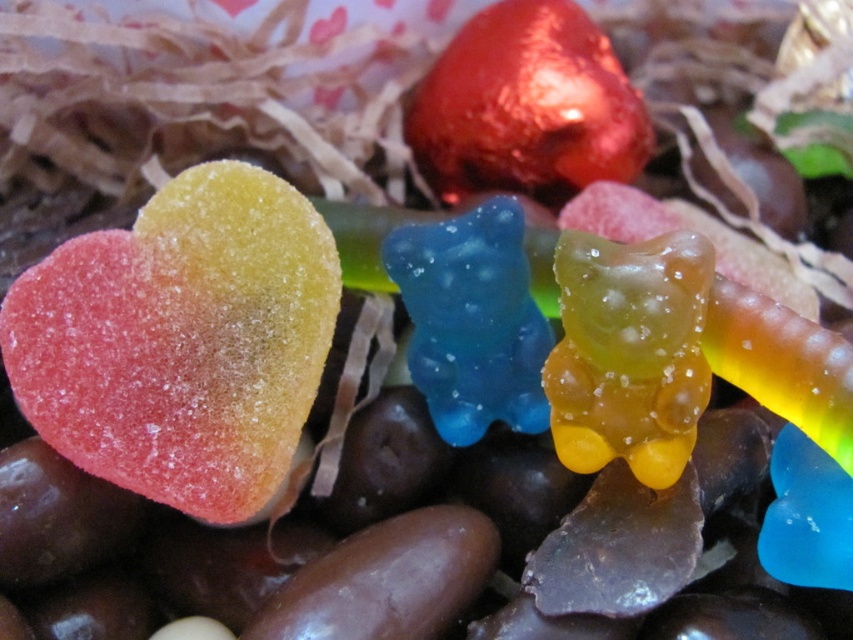
From the picture: You are looking at the image of candies and confectionery items. There are two points marked in the image, point [436,113] and point [682,436]. Which point is closer to you?

Point [436,113] is closer to you because it is further to the viewer than point [682,436].